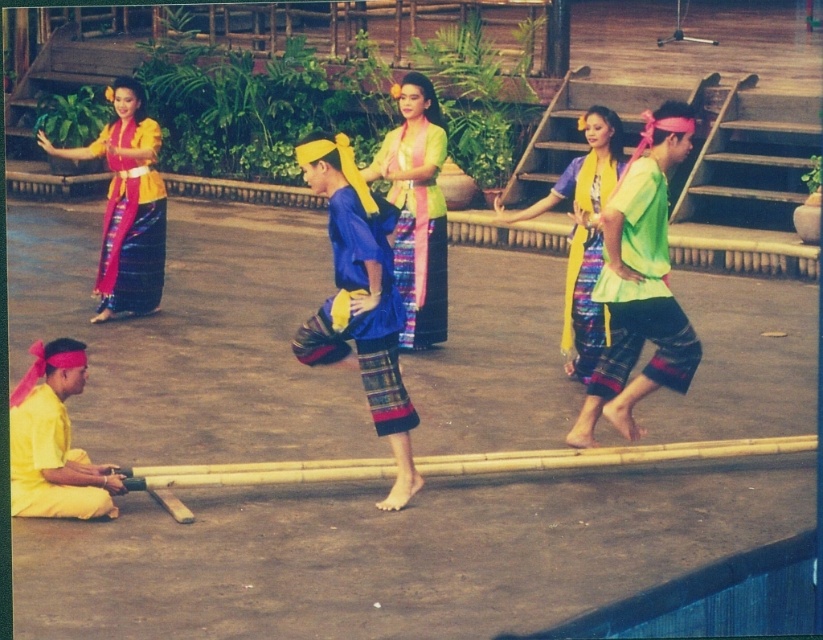
Does green fabric skirt at center have a greater width compared to matte yellow fabric skirt at left?

Yes.

Does green fabric skirt at center have a lesser height compared to matte yellow fabric skirt at left?

Yes, green fabric skirt at center is shorter than matte yellow fabric skirt at left.

Where is `green fabric skirt at center`? The image size is (823, 640). green fabric skirt at center is located at coordinates (642, 291).

Who is more forward, (91, 483) or (577, 248)?

Point (91, 483)

Is matte yellow shirt at lower left to the left of yellow fabric skirt at center from the viewer's perspective?

Yes, matte yellow shirt at lower left is to the left of yellow fabric skirt at center.

Is point (67, 444) in front of point (579, 337)?

Yes, point (67, 444) is in front of point (579, 337).

This screenshot has height=640, width=823. In order to click on matte yellow shirt at lower left in this screenshot , I will do pyautogui.click(x=54, y=442).

Who is shorter, green fabric skirt at center or matte yellow fabric at upper left?

green fabric skirt at center

Between point (649, 232) and point (58, 154), which one is positioned in front?

Point (649, 232) is more forward.

Find the location of a particular element. This screenshot has height=640, width=823. green fabric skirt at center is located at coordinates (642, 291).